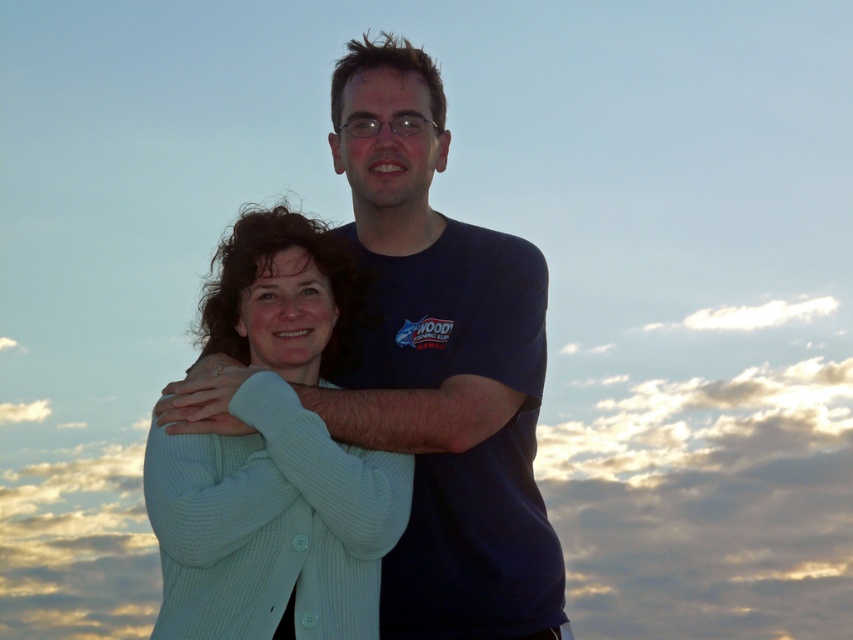
You are trying to decide which sweater to wear for a casual day out. Both the white knit sweater at center and the light blue knit sweater at center are in your closet. Based on the image, which one is visible on top?

The white knit sweater at center is positioned over the light blue knit sweater at center, so the white one is visible on top.